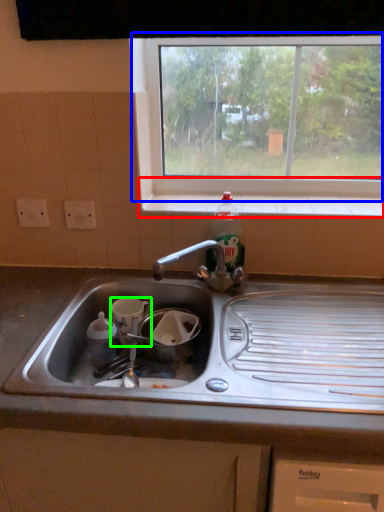
Question: Considering the real-world distances, which object is farthest from window sill (highlighted by a red box)? window (highlighted by a blue box) or appliance (highlighted by a green box)?

Choices:
 (A) window
 (B) appliance

Answer: (B)